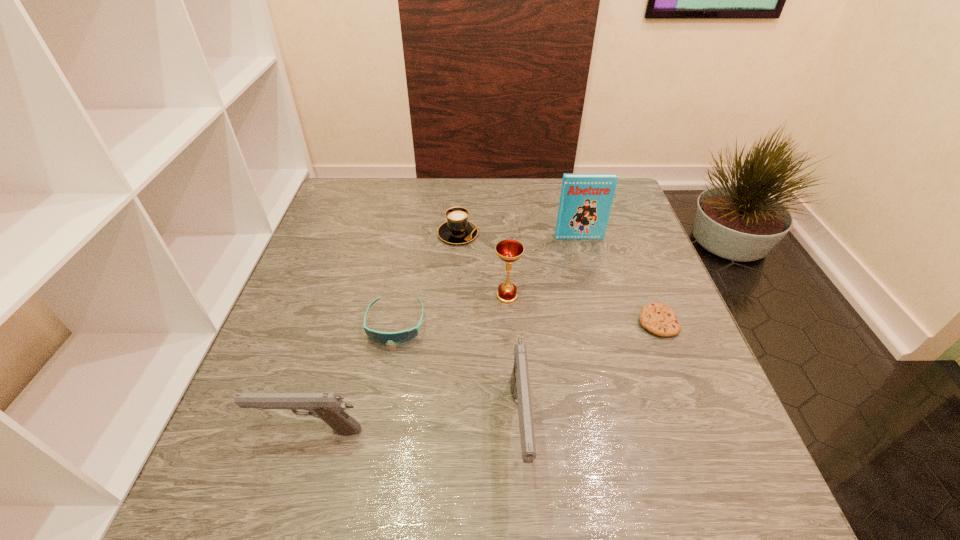
Locate an element on the screen. empty space between the shorter pistol and the right pistol is located at coordinates (415, 429).

This screenshot has width=960, height=540. What are the coordinates of `free spot between the taller pistol and the chalice` in the screenshot? It's located at click(514, 362).

Find the location of a particular element. The width and height of the screenshot is (960, 540). empty space between the taller pistol and the fifth object from right to left is located at coordinates (489, 331).

The height and width of the screenshot is (540, 960). Find the location of `vacant space that is in between the chalice and the left pistol`. vacant space that is in between the chalice and the left pistol is located at coordinates (408, 363).

In order to click on free space between the sunglasses and the cappuccino in this screenshot , I will do (x=427, y=279).

You are a GUI agent. You are given a task and a screenshot of the screen. Output one action in this format:
    pyautogui.click(x=<x>, y=<y>)
    Task: Click on the sixth closest object to the taller pistol
    
    Given the screenshot: What is the action you would take?
    pyautogui.click(x=585, y=204)

Point out which object is positioned as the fifth nearest to the cookie. Please provide its 2D coordinates. Your answer should be formatted as a tuple, i.e. [(x, y)], where the tuple contains the x and y coordinates of a point satisfying the conditions above.

[(401, 337)]

Locate an element on the screen. vacant area in the image that satisfies the following two spatial constraints: 1. on the front side of the chalice; 2. on the left side of the rightmost object is located at coordinates (509, 322).

Identify the location of free space that satisfies the following two spatial constraints: 1. on the front side of the third shortest object; 2. on the right side of the cookie. This screenshot has width=960, height=540. (453, 322).